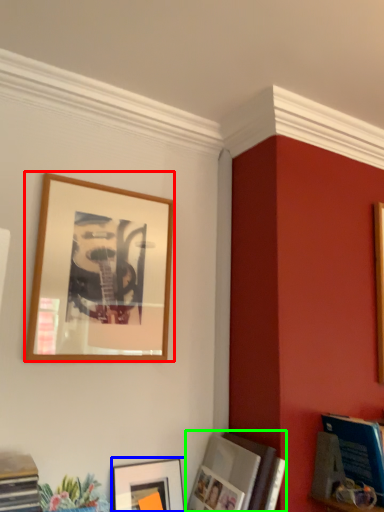
Question: Considering the real-world distances, which object is closest to picture frame (highlighted by a red box)? picture frame (highlighted by a blue box) or picture frame (highlighted by a green box).

Choices:
 (A) picture frame
 (B) picture frame

Answer: (A)